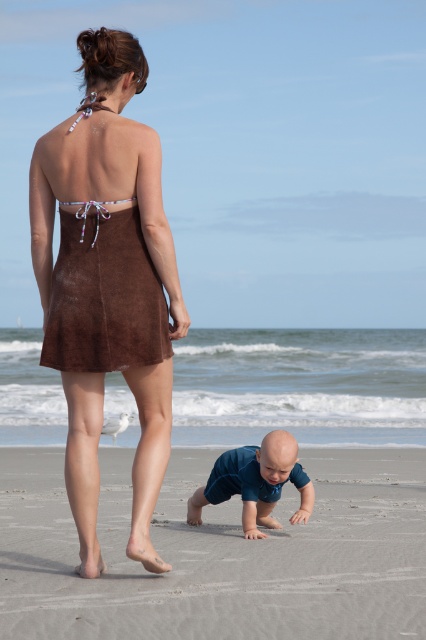
You are a photographer trying to capture the blue fabric baby at lower center and the smooth sand at lower center in the same frame. Which object is closer to the camera?

The blue fabric baby at lower center is closer to the camera since it has a greater height than the smooth sand at lower center.

You are standing on the beach and see two points marked on the sand. The first point is at coordinate point (8, 467) and the second is at point (294, 522). Which point is closer to you?

Point (8, 467) is closer to you because it is further to the viewer than point (294, 522).

From the picture: You are standing at the center of the beach and want to find the smooth sand at lower center. According to the coordinates provided, in which direction should you move to reach it?

The smooth sand at lower center is located at point coordinates, so you should move towards the lower center direction to reach it.